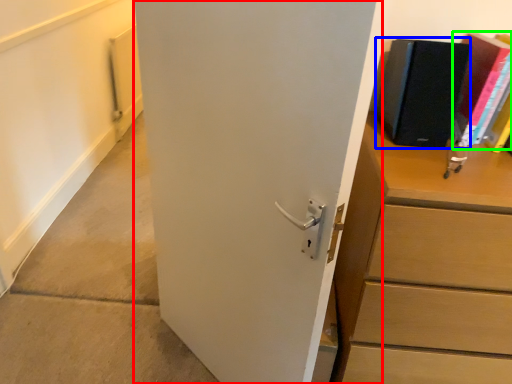
Question: Estimate the real-world distances between objects in this image. Which object is farther from door (highlighted by a red box), paperback book (highlighted by a blue box) or paperback book (highlighted by a green box)?

Choices:
 (A) paperback book
 (B) paperback book

Answer: (B)